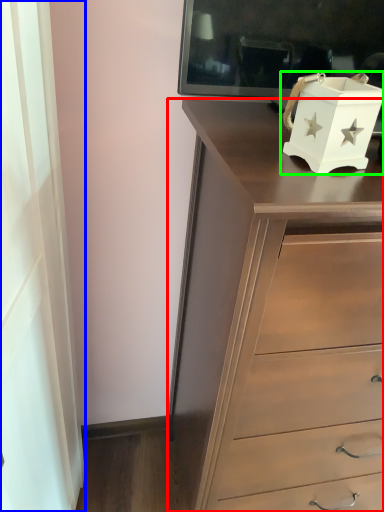
Question: Estimate the real-world distances between objects in this image. Which object is farther from chest of drawers (highlighted by a red box), curtain (highlighted by a blue box) or box (highlighted by a green box)?

Choices:
 (A) curtain
 (B) box

Answer: (A)